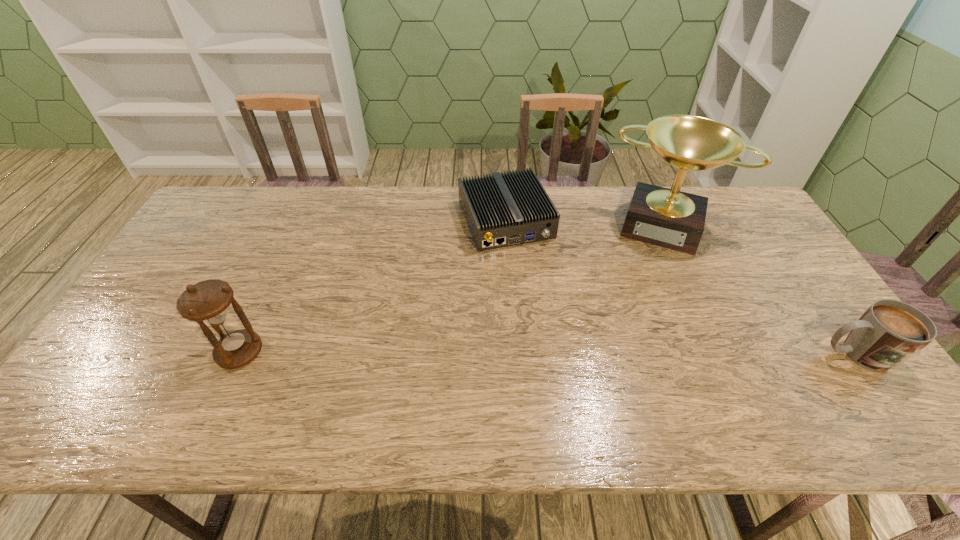
Where is `vacant space located on the side of the mug with the handle`? vacant space located on the side of the mug with the handle is located at coordinates (791, 354).

Where is `vacant space situated 0.150m on the side of the mug with the handle`? vacant space situated 0.150m on the side of the mug with the handle is located at coordinates (758, 354).

Locate an element on the screen. The height and width of the screenshot is (540, 960). free location located on the back panel of the second object from left to right is located at coordinates (551, 319).

The image size is (960, 540). What are the coordinates of `blank space located on the back panel of the second object from left to right` in the screenshot? It's located at (531, 277).

This screenshot has width=960, height=540. I want to click on free space located on the back panel of the second object from left to right, so click(x=545, y=308).

You are a GUI agent. You are given a task and a screenshot of the screen. Output one action in this format:
    pyautogui.click(x=<x>, y=<y>)
    Task: Click on the free space located 0.280m on the front-facing side of the tallest object
    
    Given the screenshot: What is the action you would take?
    pyautogui.click(x=638, y=319)

Where is `blank area located on the front-facing side of the tallest object`? This screenshot has height=540, width=960. blank area located on the front-facing side of the tallest object is located at coordinates (652, 265).

This screenshot has width=960, height=540. Identify the location of free space located on the front-facing side of the tallest object. (645, 293).

Where is `router present at the far edge`? router present at the far edge is located at coordinates (501, 210).

I want to click on award positioned at the far edge, so click(669, 218).